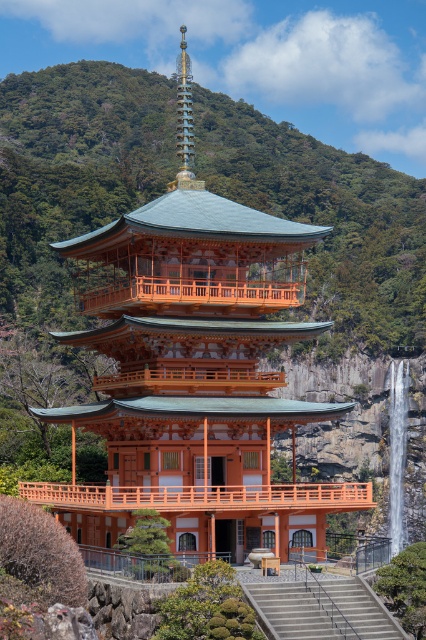
Question: Based on their relative distances, which object is nearer to the orange wood pagoda at center?

Choices:
 (A) white smooth waterfall at center right
 (B) concrete/steps at lower center

Answer: (B)

Question: Is orange wood pagoda at center in front of white smooth waterfall at center right?

Choices:
 (A) yes
 (B) no

Answer: (A)

Question: Which point is farther to the camera?

Choices:
 (A) (227, 506)
 (B) (362, 580)

Answer: (A)

Question: Is concrete/steps at lower center thinner than white smooth waterfall at center right?

Choices:
 (A) yes
 (B) no

Answer: (A)

Question: Among these objects, which one is farthest from the camera?

Choices:
 (A) orange wood pagoda at center
 (B) concrete/steps at lower center

Answer: (A)

Question: Can you confirm if concrete/steps at lower center is bigger than white smooth waterfall at center right?

Choices:
 (A) yes
 (B) no

Answer: (B)